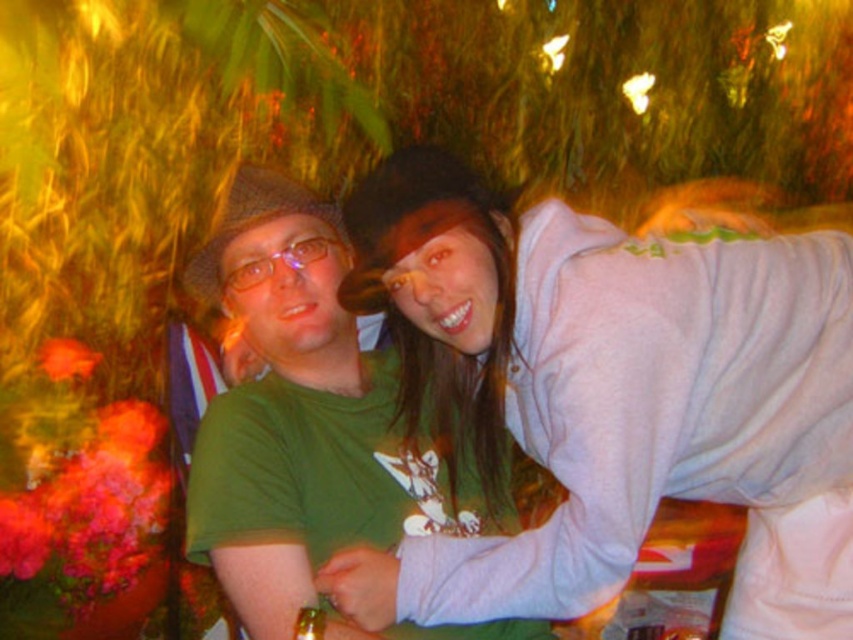
Which of these two, white soft sweatshirt at upper right or green matte shirt at center, stands shorter?

Standing shorter between the two is white soft sweatshirt at upper right.

Between white soft sweatshirt at upper right and green matte shirt at center, which one is positioned higher?

white soft sweatshirt at upper right

Measure the distance between point (827, 243) and camera.

4.89 feet

In order to click on white soft sweatshirt at upper right in this screenshot , I will do `click(614, 397)`.